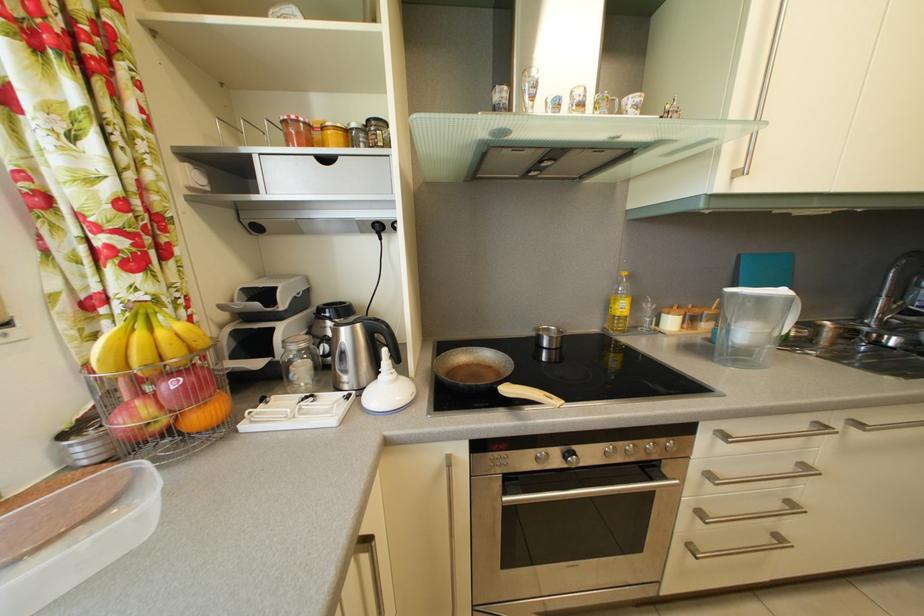
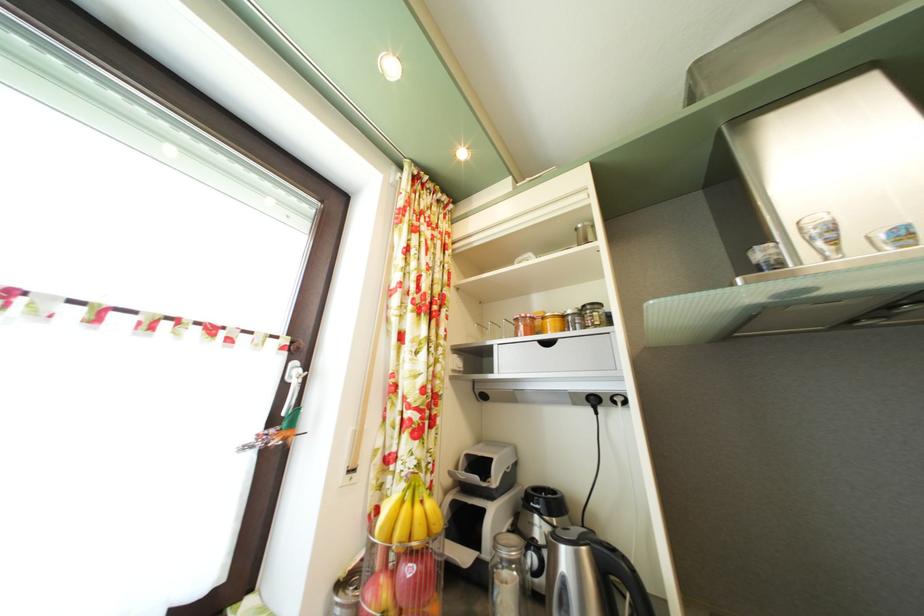
Question: I am providing you with two images of the same scene from different viewpoints. After the viewpoint changes to image2, which objects are now occluded?

Choices:
 (A) orange mango
 (B) blender pitcher
 (C) yellow lid jar
 (D) none of these

Answer: (D)